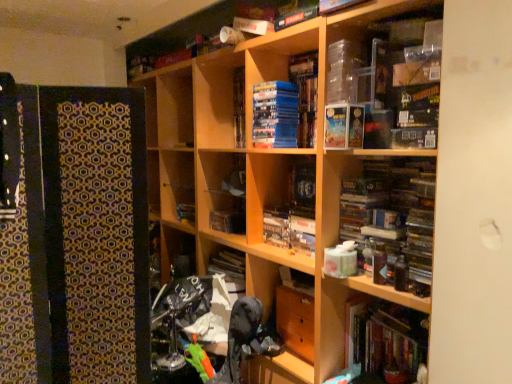
Question: Based on their sizes in the image, would you say hardcover book at center, marked as the first paperback book in a front-to-back arrangement, is bigger or smaller than blue matte stack of books at center, which appears as the first paperback book when viewed from the left?

Choices:
 (A) big
 (B) small

Answer: (B)

Question: Would you say hardcover book at center, marked as the first paperback book in a right-to-left arrangement, is inside or outside blue matte stack of books at center, which appears as the first paperback book when viewed from the left?

Choices:
 (A) inside
 (B) outside

Answer: (B)

Question: Which of these objects is positioned farthest from the hardcover book at center, which is counted as the 2th paperback book, starting from the left?

Choices:
 (A) hardcover book at center, the 2th book positioned from the front
 (B) hardcover books at lower right, which appears as the 2th book when viewed from the top
 (C) blue matte stack of books at center, the first paperback book positioned from the back
 (D) patterned fabric at left
 (E) wooden bookcase at center

Answer: (D)

Question: Which is farther from the wooden bookcase at center?

Choices:
 (A) patterned fabric at left
 (B) blue matte stack of books at center, the first paperback book positioned from the back
 (C) hardcover book at center, marked as the first paperback book in a front-to-back arrangement
 (D) hardcover book at center, the 2th book positioned from the front
 (E) hardcover books at lower right, which is counted as the second book, starting from the back

Answer: (A)